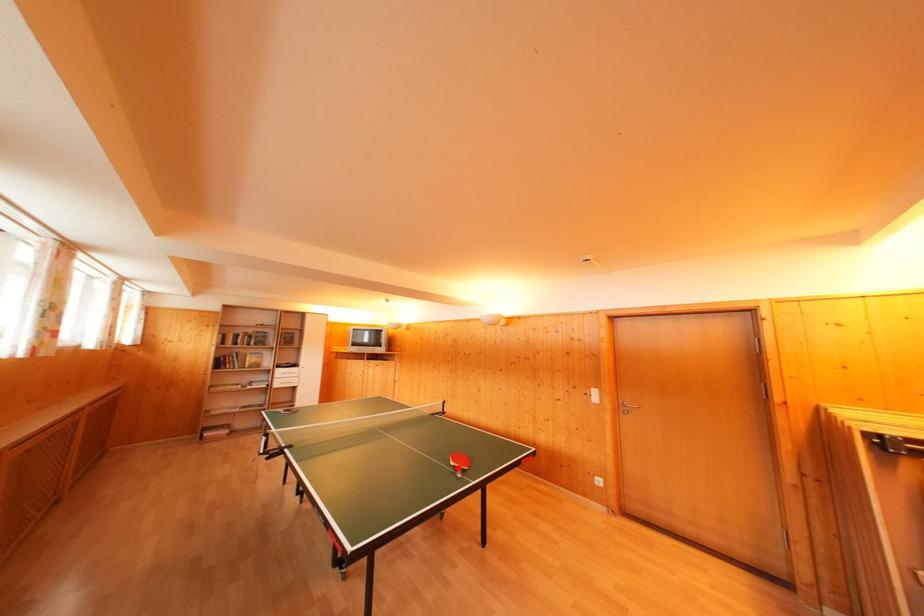
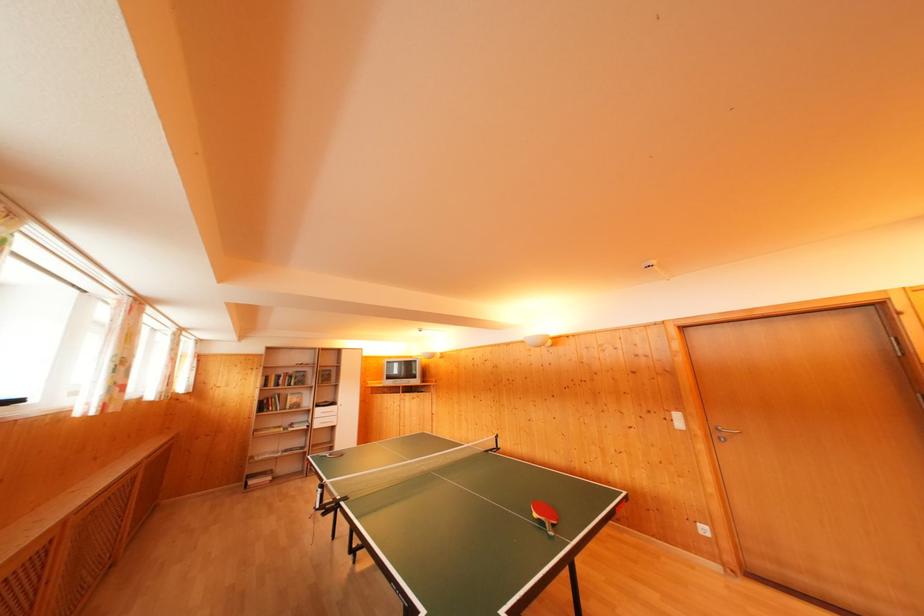
In the second image, find the point that corresponds to the highlighted location in the first image.

(541, 521)